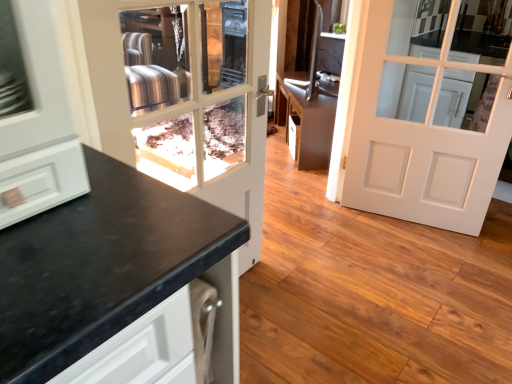
Question: From the image's perspective, relative to white matte door at center, placed as the second door when sorted from left to right, is matte black door at center, arranged as the first door when viewed from the left, above or below?

Choices:
 (A) below
 (B) above

Answer: (A)

Question: Is point (97, 52) closer or farther from the camera than point (463, 16)?

Choices:
 (A) farther
 (B) closer

Answer: (B)

Question: Which of these objects is positioned farthest from the matte black door at center, marked as the second door in a right-to-left arrangement?

Choices:
 (A) white matte door at center, placed as the second door when sorted from left to right
 (B) brown matte cabinet at center

Answer: (A)

Question: Which of these objects is positioned closest to the matte black door at center, arranged as the first door when viewed from the left?

Choices:
 (A) brown matte cabinet at center
 (B) white matte door at center, placed as the second door when sorted from left to right

Answer: (A)